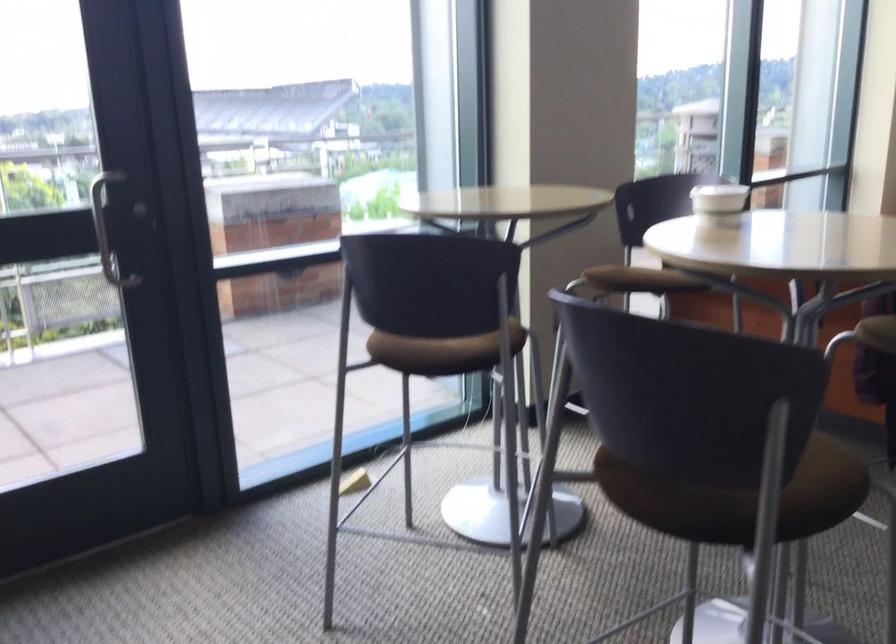
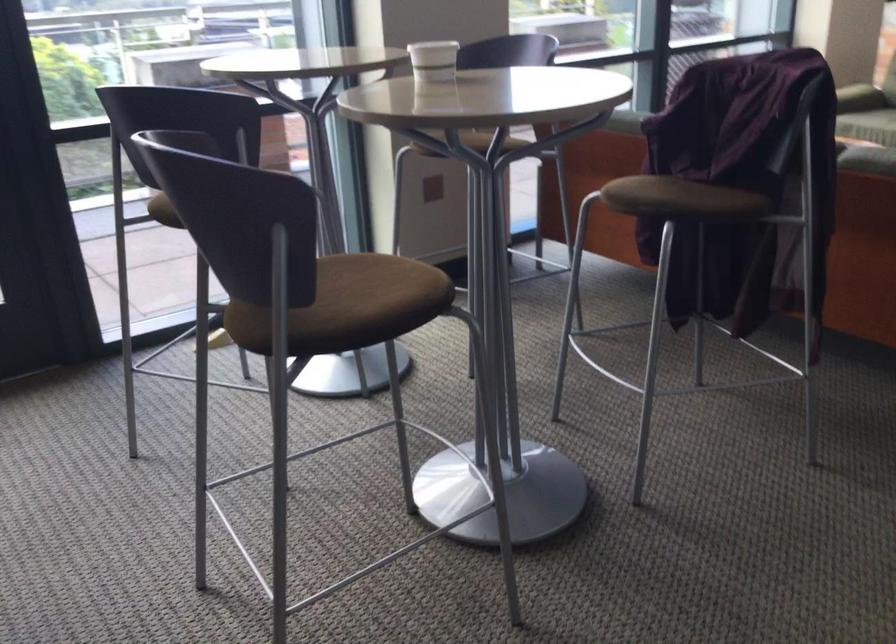
Question: The first image is from the beginning of the video and the second image is from the end. How did the camera likely rotate when shooting the video?

Choices:
 (A) Left
 (B) Right
 (C) Up
 (D) Down

Answer: (D)